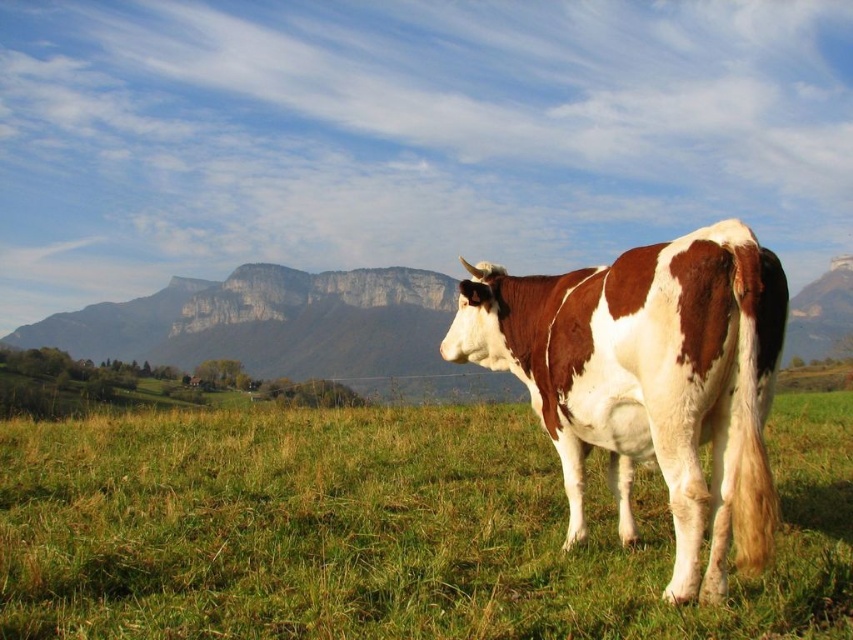
You are a drone operator trying to capture a photo of the cow in the green grassy area at center. The cow is located at position coordinates of 0.750, 0.400. Can you determine if the cow is within the green grassy at center area?

The green grassy at center is located at position coordinates of (383,531). The cow is at (340,480), so the cow is not within the green grassy at center area because the coordinates are different.